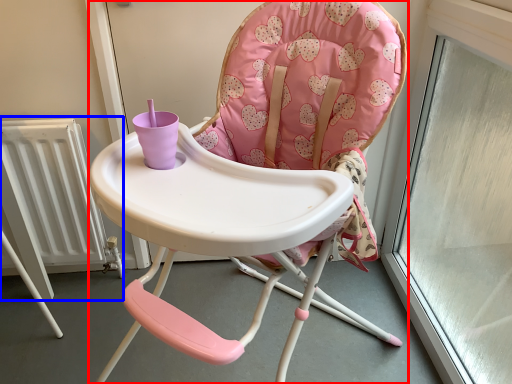
Question: Among these objects, which one is nearest to the camera, chair (highlighted by a red box) or radiator (highlighted by a blue box)?

Choices:
 (A) chair
 (B) radiator

Answer: (A)